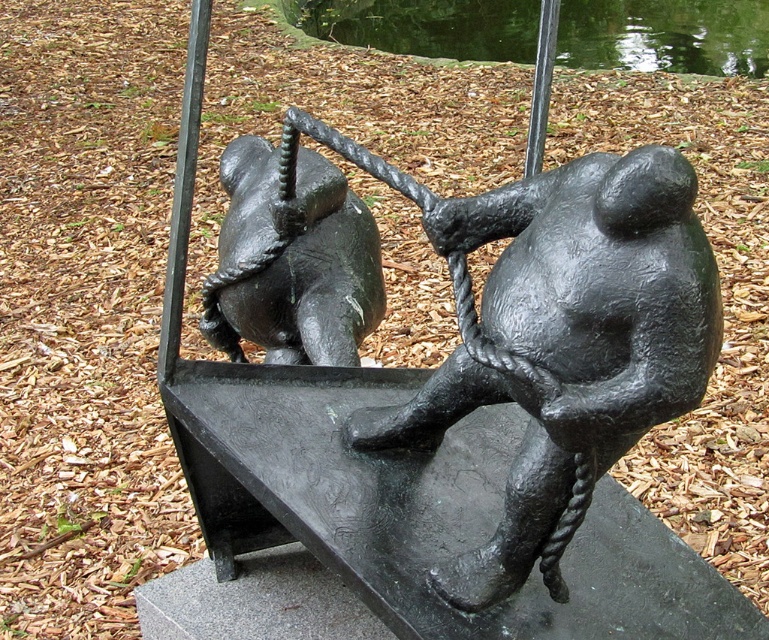
Does black matte sculpture at center have a smaller size compared to black matte bear at center?

Actually, black matte sculpture at center might be larger than black matte bear at center.

Who is more distant from viewer, [604,262] or [290,276]?

The point [290,276] is more distant.

What do you see at coordinates (551, 333) in the screenshot?
I see `black matte sculpture at center` at bounding box center [551, 333].

Locate an element on the screen. The width and height of the screenshot is (769, 640). black matte sculpture at center is located at coordinates (551, 333).

Image resolution: width=769 pixels, height=640 pixels. What do you see at coordinates (291, 260) in the screenshot?
I see `black matte bear at center` at bounding box center [291, 260].

Image resolution: width=769 pixels, height=640 pixels. Find the location of `black matte bear at center`. black matte bear at center is located at coordinates (291, 260).

The image size is (769, 640). I want to click on black matte bear at center, so click(291, 260).

Between black matte sculpture at center and glossy reflective water at upper center, which one has less height?

Standing shorter between the two is black matte sculpture at center.

Which is more to the right, black matte sculpture at center or glossy reflective water at upper center?

glossy reflective water at upper center

Image resolution: width=769 pixels, height=640 pixels. Find the location of `black matte sculpture at center`. black matte sculpture at center is located at coordinates (551, 333).